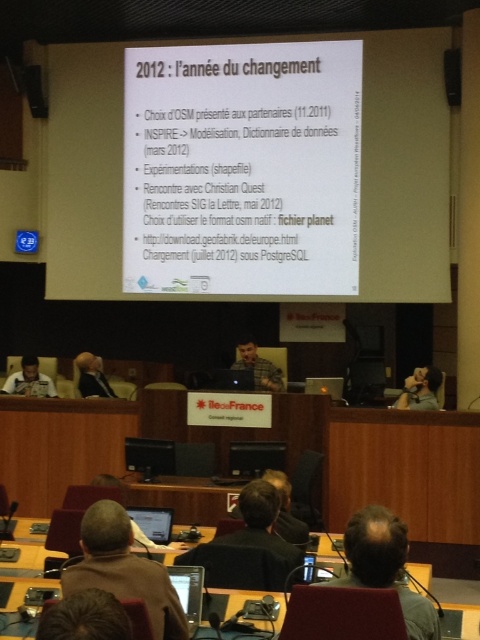
Does black fabric jacket at center have a lesser width compared to matte black person at lower right?

No, black fabric jacket at center is not thinner than matte black person at lower right.

Between point (237, 557) and point (432, 378), which one is positioned behind?

The point (432, 378) is more distant.

Identify the location of black fabric jacket at center. The width and height of the screenshot is (480, 640). (248, 547).

Who is positioned more to the right, gray hair at center or matte black laptop at lower left?

From the viewer's perspective, gray hair at center appears more on the right side.

Which is in front, point (351, 541) or point (6, 380)?

Positioned in front is point (351, 541).

Between point (396, 522) and point (23, 387), which one is positioned behind?

Point (23, 387)

Image resolution: width=480 pixels, height=640 pixels. I want to click on gray hair at center, so click(x=384, y=566).

Is dark brown hair at lower center taller than light brown hair at lower left?

Incorrect, dark brown hair at lower center's height is not larger of light brown hair at lower left's.

Consider the image. Does dark brown hair at lower center have a lesser width compared to light brown hair at lower left?

Indeed, dark brown hair at lower center has a lesser width compared to light brown hair at lower left.

Is point (112, 636) closer to viewer compared to point (104, 388)?

Yes, it is.

Find the location of a particular element. The image size is (480, 640). dark brown hair at lower center is located at coordinates (84, 618).